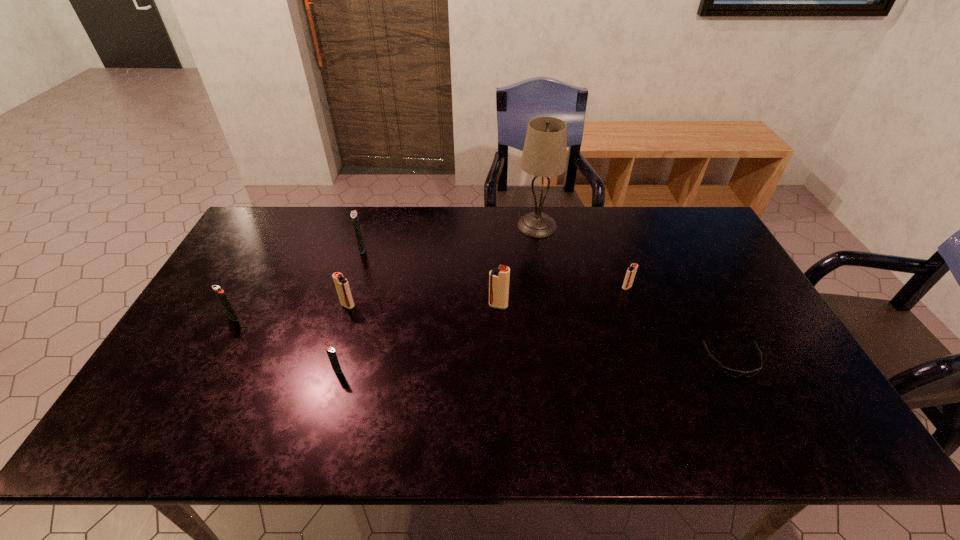
You are a GUI agent. You are given a task and a screenshot of the screen. Output one action in this format:
    pyautogui.click(x=<x>, y=<y>)
    Task: Click on the tallest object
    This screenshot has width=960, height=540.
    Given the screenshot: What is the action you would take?
    pyautogui.click(x=544, y=154)

You are a GUI agent. You are given a task and a screenshot of the screen. Output one action in this format:
    pyautogui.click(x=<x>, y=<y>)
    Task: Click on the farthest object
    
    Given the screenshot: What is the action you would take?
    pyautogui.click(x=544, y=154)

Identify the location of the second red igniter from left to right. This screenshot has height=540, width=960. point(499,278).

Find the location of a particular element. The image size is (960, 540). the biggest red igniter is located at coordinates (499, 278).

The height and width of the screenshot is (540, 960). What are the coordinates of `the second farthest object` in the screenshot? It's located at (354, 216).

This screenshot has width=960, height=540. I want to click on the second black igniter from left to right, so click(354, 216).

You are a GUI agent. You are given a task and a screenshot of the screen. Output one action in this format:
    pyautogui.click(x=<x>, y=<y>)
    Task: Click on the leftmost object
    The height and width of the screenshot is (540, 960).
    Given the screenshot: What is the action you would take?
    pyautogui.click(x=220, y=293)

The height and width of the screenshot is (540, 960). I want to click on the leftmost black igniter, so click(220, 293).

In order to click on the leftmost red igniter in this screenshot , I will do `click(342, 286)`.

Find the location of a particular element. the farthest red igniter is located at coordinates (630, 274).